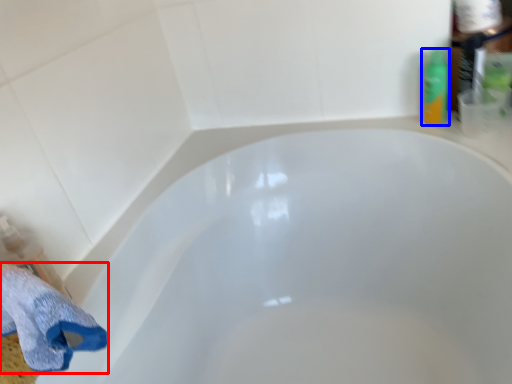
Question: Which object is closer to the camera taking this photo, bath towel (highlighted by a red box) or toiletry (highlighted by a blue box)?

Choices:
 (A) bath towel
 (B) toiletry

Answer: (A)